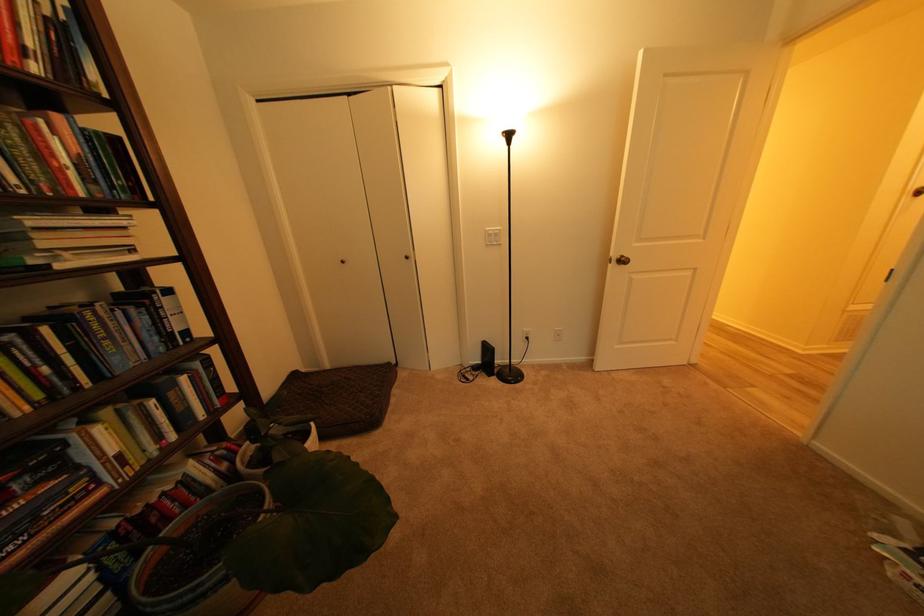
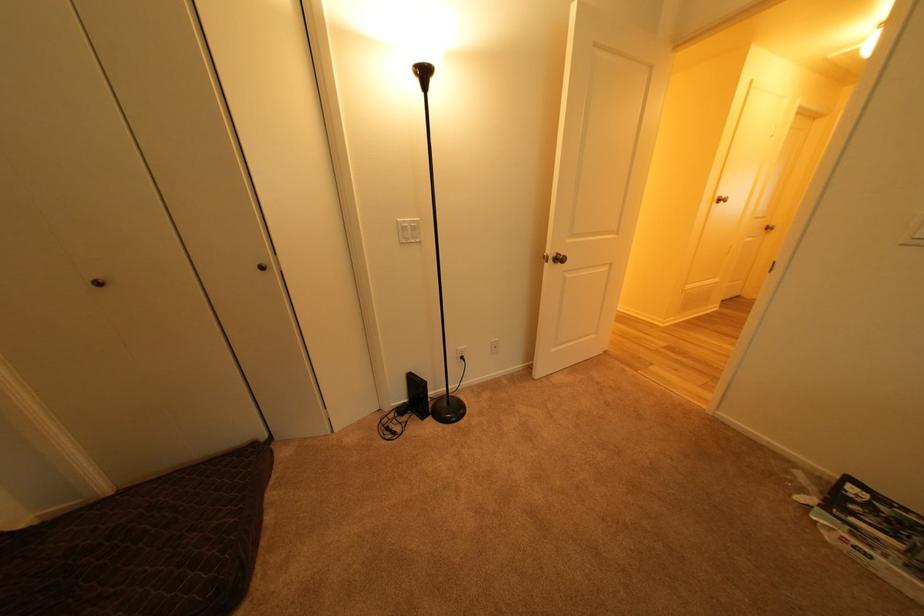
Find the pixel in the second image that matches (621,265) in the first image.

(557, 264)